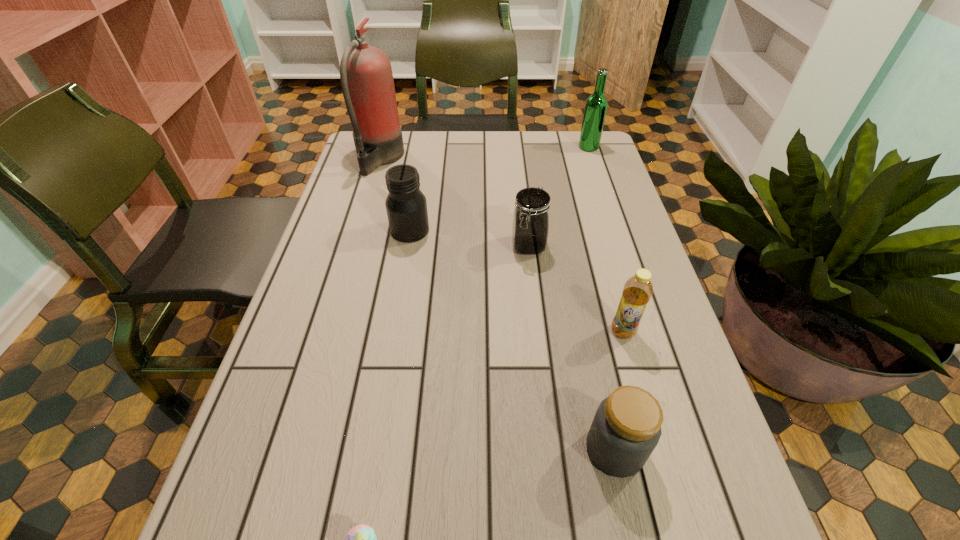
Image resolution: width=960 pixels, height=540 pixels. I want to click on free spot between the tallest jar and the fifth farthest object, so (516, 281).

At what (x,y) coordinates should I click in order to perform the action: click on free space that is in between the fourth object from left to right and the beer bottle. Please return your answer as a coordinate pair (x, y). The height and width of the screenshot is (540, 960). Looking at the image, I should click on (559, 196).

The height and width of the screenshot is (540, 960). In order to click on free area in between the tallest object and the rightmost jar in this screenshot , I will do `click(497, 304)`.

At what (x,y) coordinates should I click in order to perform the action: click on object that is the second closest to the leftmost jar. Please return your answer as a coordinate pair (x, y). Looking at the image, I should click on (530, 227).

You are a GUI agent. You are given a task and a screenshot of the screen. Output one action in this format:
    pyautogui.click(x=<x>, y=<y>)
    Task: Click on the object identified as the second closest to the tallest jar
    The image size is (960, 540).
    Given the screenshot: What is the action you would take?
    pyautogui.click(x=530, y=227)

Select which jar is the closest to the second tallest object. Please provide its 2D coordinates. Your answer should be formatted as a tuple, i.e. [(x, y)], where the tuple contains the x and y coordinates of a point satisfying the conditions above.

[(530, 227)]

At what (x,y) coordinates should I click in order to perform the action: click on the second closest jar relative to the tallest jar. Please return your answer as a coordinate pair (x, y). Looking at the image, I should click on (626, 428).

This screenshot has height=540, width=960. What are the coordinates of `free spot that satisfies the following two spatial constraints: 1. on the front side of the second tallest object; 2. on the surface of the second nearest object near the warning symbol` in the screenshot? It's located at (689, 449).